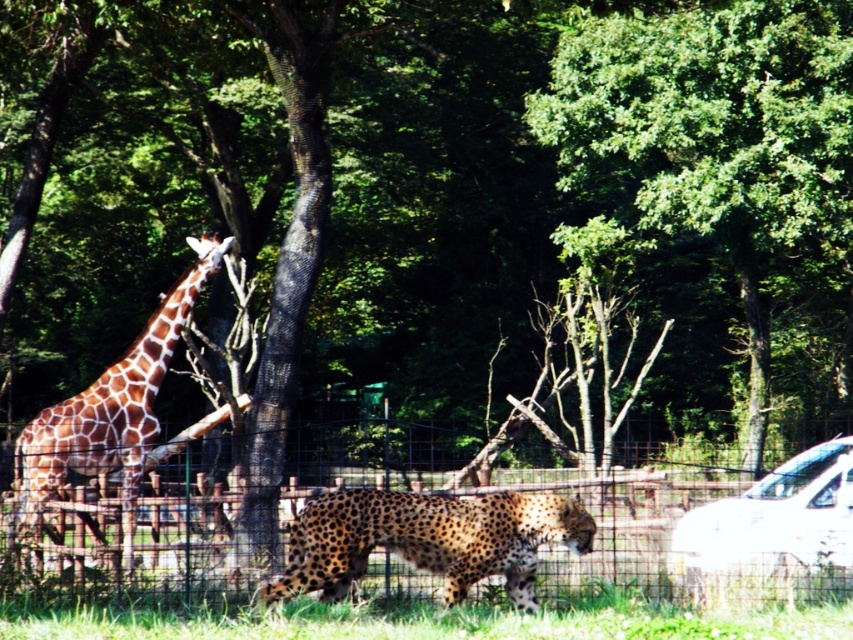
You are a zookeeper trying to locate two specific points in the enclosure. The first point is at coordinate point (679, 99) and the second is at point (717, 493). From your current position, which point is closer to you?

Point (717, 493) is closer to you because it is in front of point (679, 99).

You are a zookeeper observing the giraffe and cheetah in their enclosure. You notice the green leafy tree at center and the metal wire fence at center. Which object is higher in the image?

The green leafy tree at center is positioned over the metal wire fence at center, so it is higher in the image.